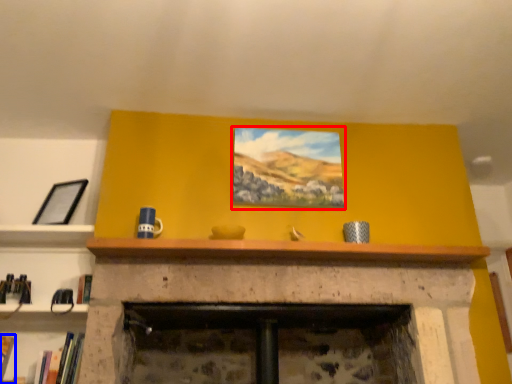
Question: Which object is further to the camera taking this photo, picture frame (highlighted by a red box) or book (highlighted by a blue box)?

Choices:
 (A) picture frame
 (B) book

Answer: (A)